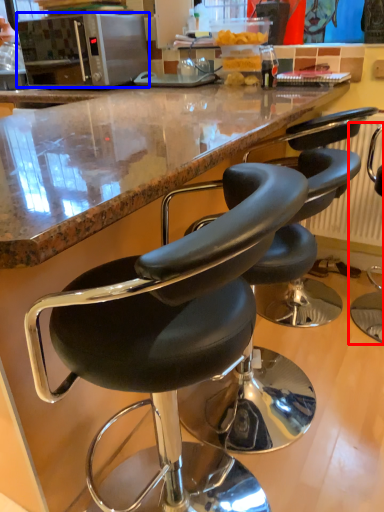
Question: Which object is further to the camera taking this photo, chair (highlighted by a red box) or microwave oven (highlighted by a blue box)?

Choices:
 (A) chair
 (B) microwave oven

Answer: (B)